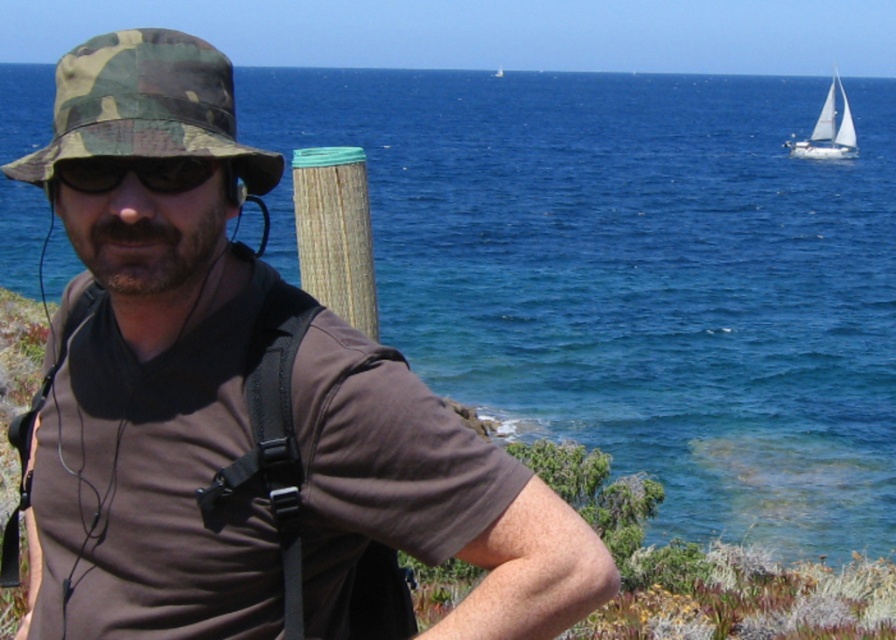
Question: Which of the following is the farthest from the observer?

Choices:
 (A) white sailboat at upper right
 (B) black matte sunglasses at center

Answer: (A)

Question: Observing the image, what is the correct spatial positioning of wooden post at center in reference to black matte sunglasses at center?

Choices:
 (A) below
 (B) above

Answer: (B)

Question: Is black matte sunglasses at center to the left of white sailboat at upper right from the viewer's perspective?

Choices:
 (A) no
 (B) yes

Answer: (B)

Question: Which point is closer to the camera?

Choices:
 (A) (29, 548)
 (B) (837, 83)
 (C) (66, 163)
 (D) (341, 285)

Answer: (C)

Question: Considering the real-world distances, which object is farthest from the brown matte shirt at center?

Choices:
 (A) black matte sunglasses at center
 (B) camo fabric hat at upper left
 (C) white sailboat at upper right
 (D) wooden post at center

Answer: (C)

Question: Can you confirm if camo fabric hat at upper left is positioned below white sailboat at upper right?

Choices:
 (A) no
 (B) yes

Answer: (B)